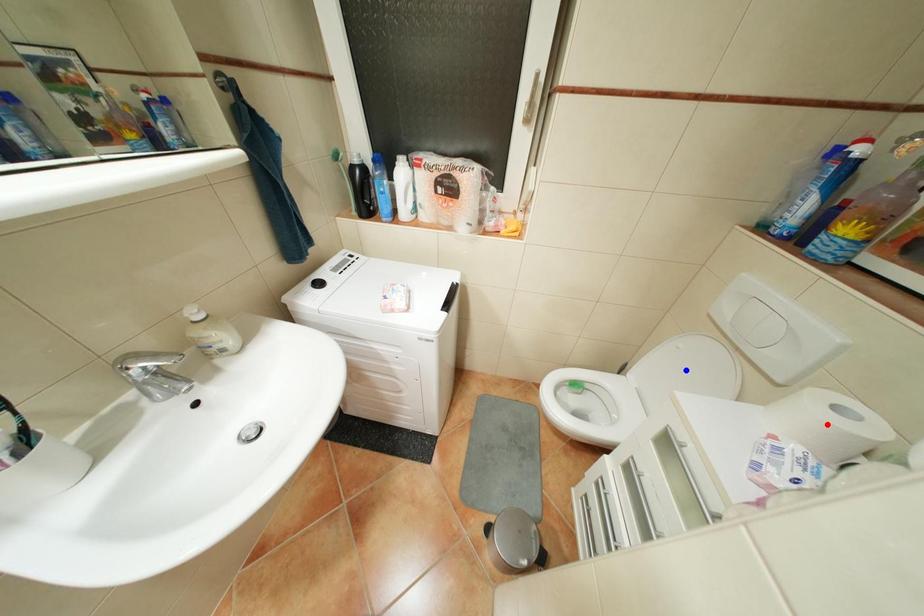
Question: Two points are marked on the image. Which point is closer to the camera?

Choices:
 (A) Blue point is closer.
 (B) Red point is closer.

Answer: (B)